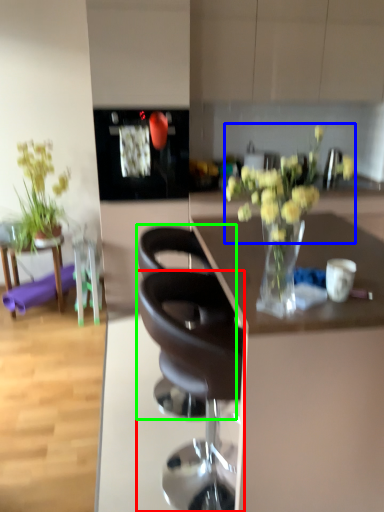
Question: Which object is the closest to the chair (highlighted by a red box)? Choose among these: flower (highlighted by a blue box) or chair (highlighted by a green box).

Choices:
 (A) flower
 (B) chair

Answer: (B)